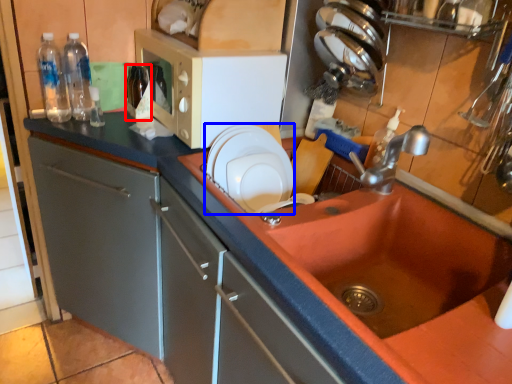
Question: Which object is closer to the camera taking this photo, bottle (highlighted by a red box) or appliance (highlighted by a blue box)?

Choices:
 (A) bottle
 (B) appliance

Answer: (B)